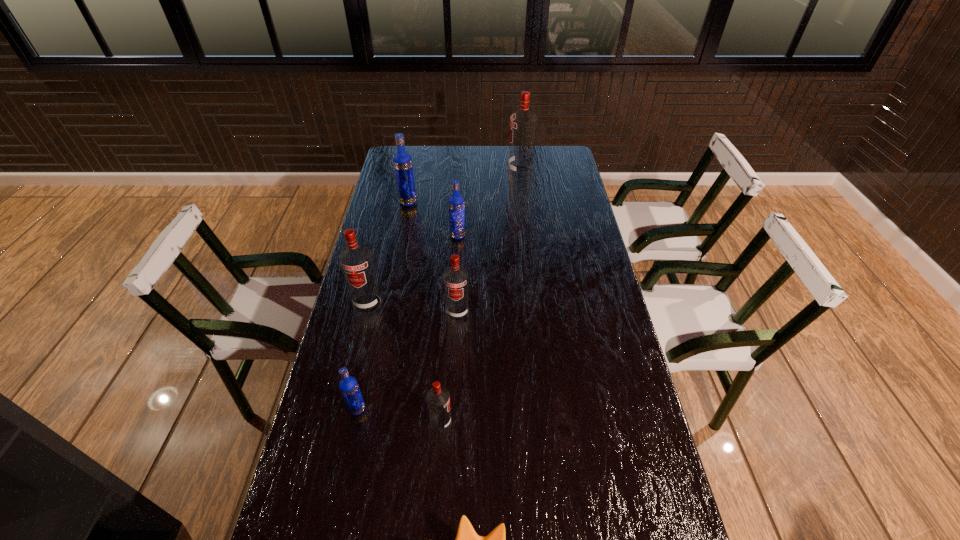
This screenshot has width=960, height=540. I want to click on free space at the far edge of the desktop, so click(x=491, y=166).

What are the coordinates of `vacant space at the left edge of the desktop` in the screenshot? It's located at (361, 322).

You are a GUI agent. You are given a task and a screenshot of the screen. Output one action in this format:
    pyautogui.click(x=<x>, y=<y>)
    Task: Click on the vacant space at the right edge of the desktop
    This screenshot has height=540, width=960.
    Given the screenshot: What is the action you would take?
    pyautogui.click(x=559, y=197)

Find the location of a particular element. vacant space at the far left corner is located at coordinates (416, 160).

You are a GUI agent. You are given a task and a screenshot of the screen. Output one action in this format:
    pyautogui.click(x=<x>, y=<y>)
    Task: Click on the vacant space at the far right corner
    The image size is (960, 540).
    Given the screenshot: What is the action you would take?
    pyautogui.click(x=558, y=164)

Locate an element on the screen. vacant area that lies between the third biggest red vodka and the leftmost red vodka is located at coordinates (413, 308).

The image size is (960, 540). I want to click on free area in between the nearest blue vodka and the second biggest red vodka, so click(x=363, y=356).

Locate an element on the screen. This screenshot has width=960, height=540. vacant area between the third smallest red vodka and the smallest red vodka is located at coordinates (404, 363).

You are a GUI agent. You are given a task and a screenshot of the screen. Output one action in this format:
    pyautogui.click(x=<x>, y=<y>)
    Task: Click on the free space between the nearest blue vodka and the second smallest red vodka
    Image resolution: width=960 pixels, height=540 pixels.
    Given the screenshot: What is the action you would take?
    pyautogui.click(x=407, y=361)

At what (x,y) coordinates should I click in order to perform the action: click on free spot between the farthest blue vodka and the smallest red vodka. Please return your answer as a coordinate pair (x, y). The image size is (960, 540). Looking at the image, I should click on (424, 312).